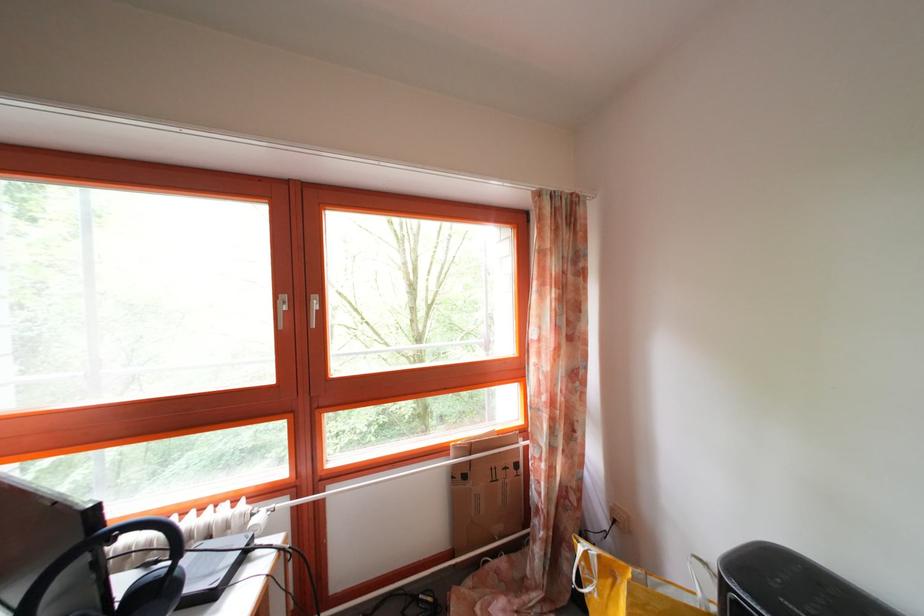
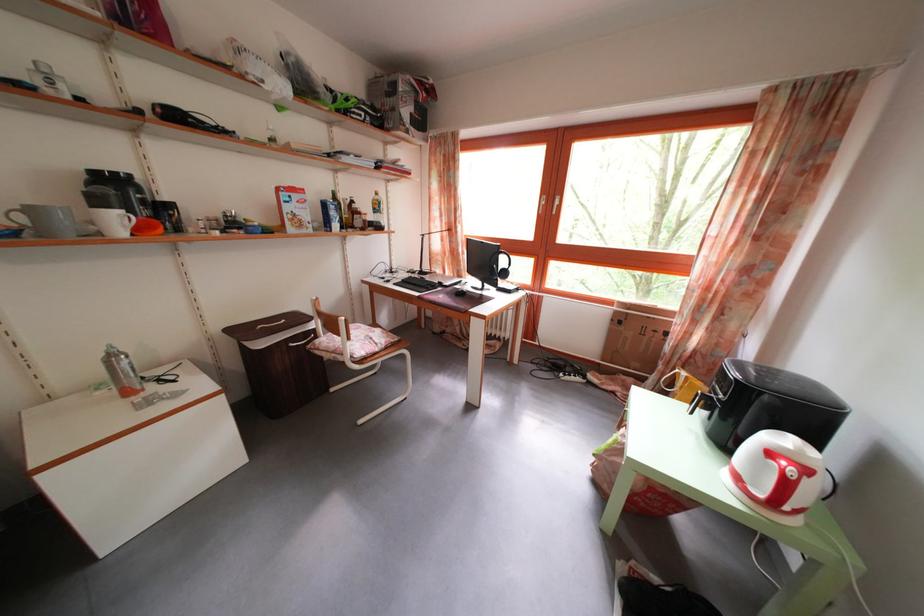
Find the pixel in the second image that matches (x=601, y=559) in the first image.

(691, 381)